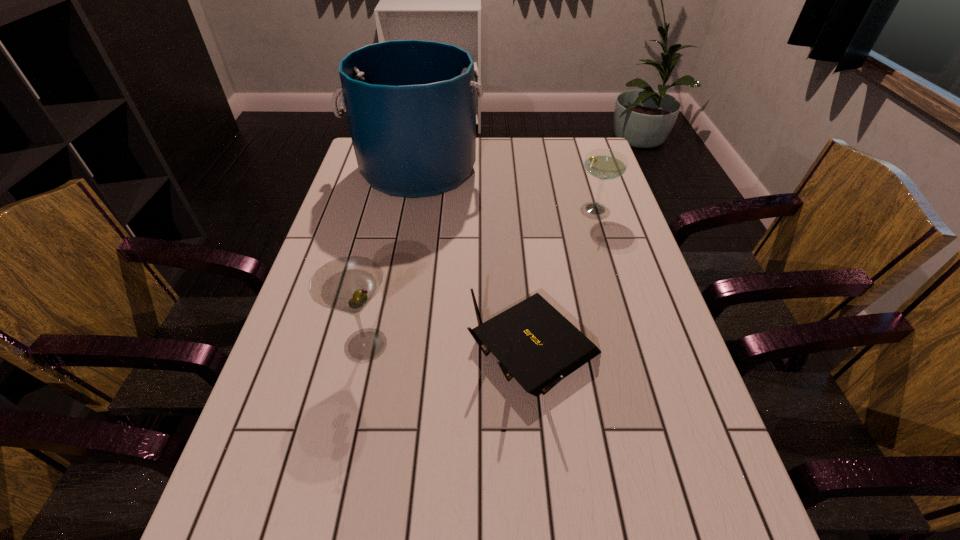
Image resolution: width=960 pixels, height=540 pixels. Identify the location of object that is at the far edge. (410, 104).

The width and height of the screenshot is (960, 540). What are the coordinates of `bucket located at the left edge` in the screenshot? It's located at (410, 104).

Locate an element on the screen. Image resolution: width=960 pixels, height=540 pixels. martini that is at the left edge is located at coordinates (347, 284).

Locate an element on the screen. object that is at the right edge is located at coordinates (604, 164).

Where is `object that is at the far left corner`? This screenshot has width=960, height=540. object that is at the far left corner is located at coordinates (410, 104).

Image resolution: width=960 pixels, height=540 pixels. Identify the location of vacant area at the far edge of the desktop. (539, 171).

Find the location of a particular element. This screenshot has height=540, width=960. vacant area at the left edge of the desktop is located at coordinates (301, 315).

The width and height of the screenshot is (960, 540). I want to click on vacant space at the right edge of the desktop, so click(640, 256).

Locate an element on the screen. The width and height of the screenshot is (960, 540). free space between the router and the farther martini is located at coordinates (564, 279).

Find the location of a particular element. This screenshot has width=960, height=540. free area in between the taller martini and the tallest object is located at coordinates (392, 258).